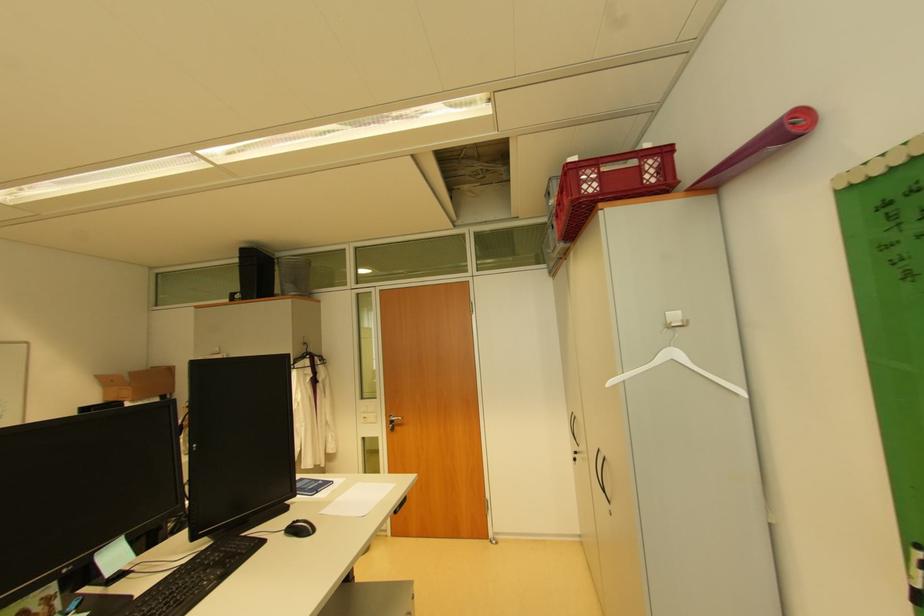
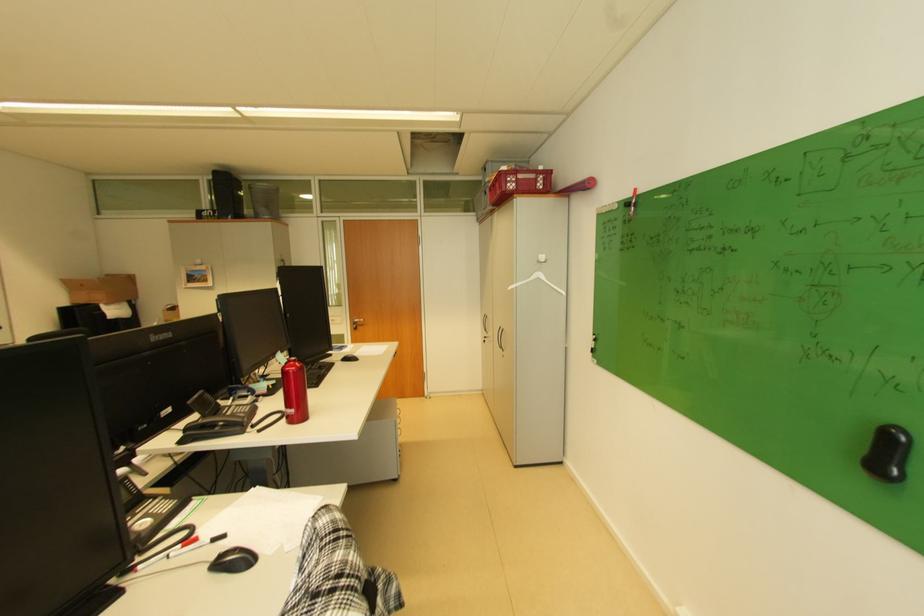
In the second image, find the point that corresponds to the point at 298,288 in the first image.

(272, 211)